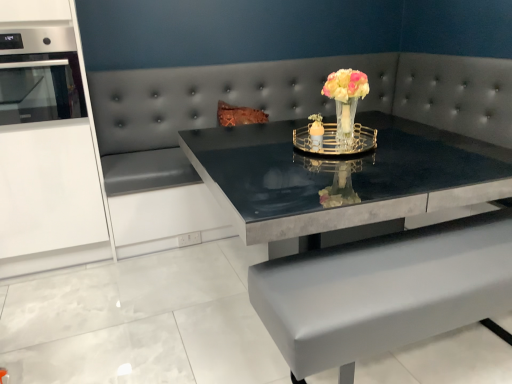
Question: Is shiny black table at center aimed at translucent glass vase at center?

Choices:
 (A) yes
 (B) no

Answer: (B)

Question: Can you confirm if shiny black table at center is smaller than translucent glass vase at center?

Choices:
 (A) yes
 (B) no

Answer: (B)

Question: From the image's perspective, would you say shiny black table at center is positioned over translucent glass vase at center?

Choices:
 (A) yes
 (B) no

Answer: (B)

Question: Considering the relative sizes of shiny black table at center and translucent glass vase at center in the image provided, is shiny black table at center wider than translucent glass vase at center?

Choices:
 (A) no
 (B) yes

Answer: (B)

Question: Is the position of shiny black table at center more distant than that of translucent glass vase at center?

Choices:
 (A) no
 (B) yes

Answer: (A)

Question: Based on their sizes in the image, would you say stainless steel oven at left is bigger or smaller than translucent glass vase at center?

Choices:
 (A) small
 (B) big

Answer: (B)

Question: From a real-world perspective, relative to translucent glass vase at center, is stainless steel oven at left vertically above or below?

Choices:
 (A) below
 (B) above

Answer: (B)

Question: Relative to translucent glass vase at center, is stainless steel oven at left in front or behind?

Choices:
 (A) front
 (B) behind

Answer: (B)

Question: Is stainless steel oven at left inside or outside of translucent glass vase at center?

Choices:
 (A) outside
 (B) inside

Answer: (A)

Question: Does point (343, 92) appear closer or farther from the camera than point (450, 279)?

Choices:
 (A) farther
 (B) closer

Answer: (A)

Question: In the image, is translucent glass vase at center positioned in front of or behind shiny black table at center?

Choices:
 (A) front
 (B) behind

Answer: (B)

Question: Looking at the image, does translucent glass vase at center seem bigger or smaller compared to shiny black table at center?

Choices:
 (A) big
 (B) small

Answer: (B)

Question: Visually, is translucent glass vase at center positioned to the left or to the right of shiny black table at center?

Choices:
 (A) right
 (B) left

Answer: (B)

Question: Is stainless steel oven at left taller or shorter than shiny black table at center?

Choices:
 (A) tall
 (B) short

Answer: (B)

Question: Is point (49, 64) closer or farther from the camera than point (475, 296)?

Choices:
 (A) farther
 (B) closer

Answer: (A)